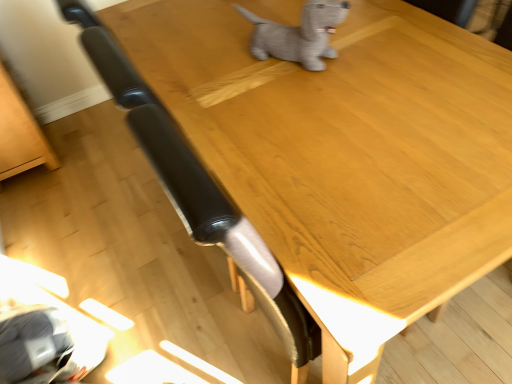
Identify the location of vacant area to the right of light brown wood table at lower left. (105, 151).